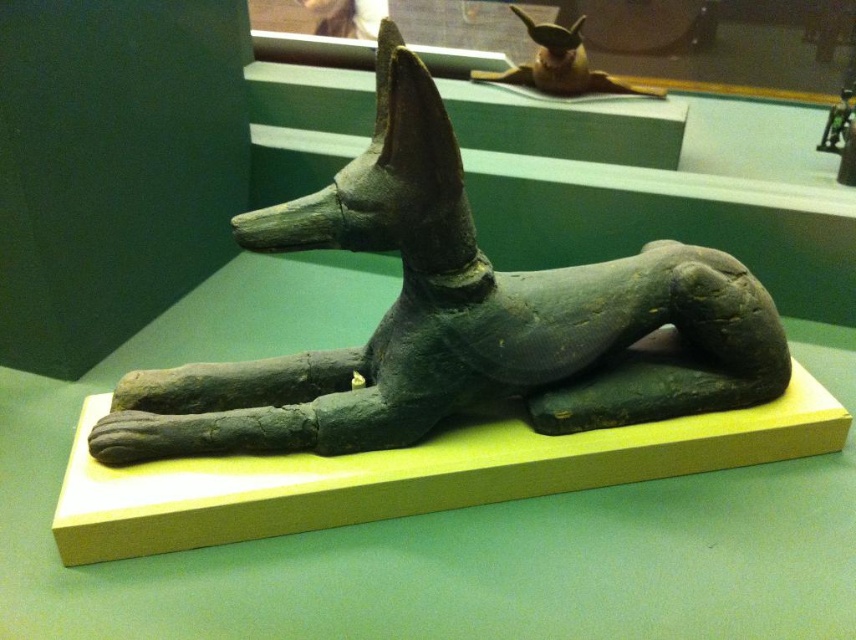
You are an archaeologist examining the ancient Egyptian statue of a Canine deity. You notice two points marked on the statue. One is at coordinate point (730,355) and the other at point (470,80). Which of these points is closer to your viewpoint?

A: Point (730,355) is closer to the camera than point (470,80).

You are an archaeologist examining two statues in a museum. You have a measuring tape that can only measure up to 1 meter. The matte black statue at center and the shiny gold statue at upper center are both on display. Which statue should you measure first if you want to know which one is wider?

You should measure the shiny gold statue at upper center first. Since the matte black statue at center is wider than the shiny gold statue at upper center, if the shiny gold statue at upper center is already over 1 meter in width, then the matte black statue at center would also be too wide to measure. This way, you can determine the wider statue without needing to measure both.

You are an archaeologist examining two statues in a museum. You notice the matte black statue at center and the shiny gold statue at upper center. Which statue is closer to you?

The matte black statue at center is closer to you because it is positioned in front of the shiny gold statue at upper center.